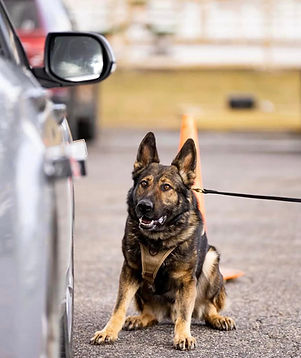
Identify the location of windows. The width and height of the screenshot is (301, 358). (212, 47).